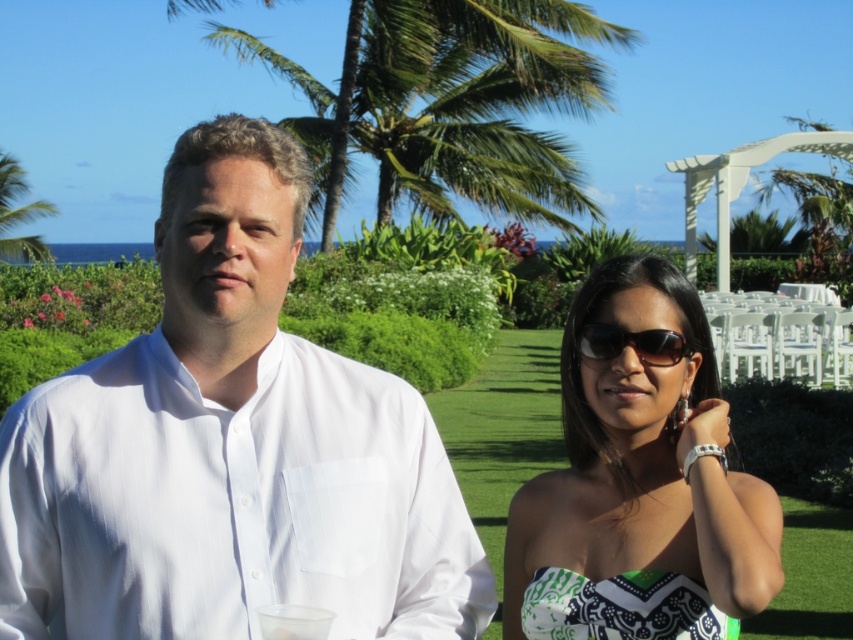
Based on the scene description, which palm tree is wider between the green leafy palm tree at upper center and the green leafy palm tree at upper left?

The green leafy palm tree at upper center is wider than the green leafy palm tree at upper left.

You are standing at the point labeled point (x=32, y=252) and want to walk towards the point labeled point (x=578, y=72). Which direction should you face to move directly towards your destination?

You should face forward because point (x=578, y=72) is in front of point (x=32, y=252).